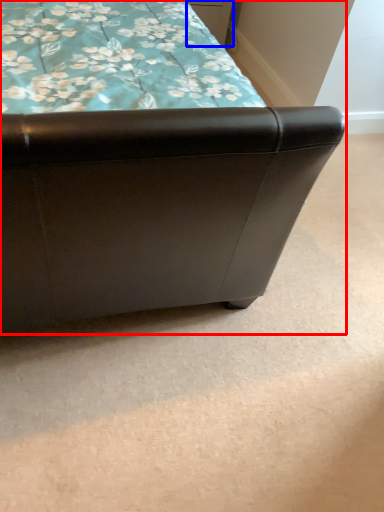
Question: Among these objects, which one is farthest to the camera, furniture (highlighted by a red box) or drawer (highlighted by a blue box)?

Choices:
 (A) furniture
 (B) drawer

Answer: (B)